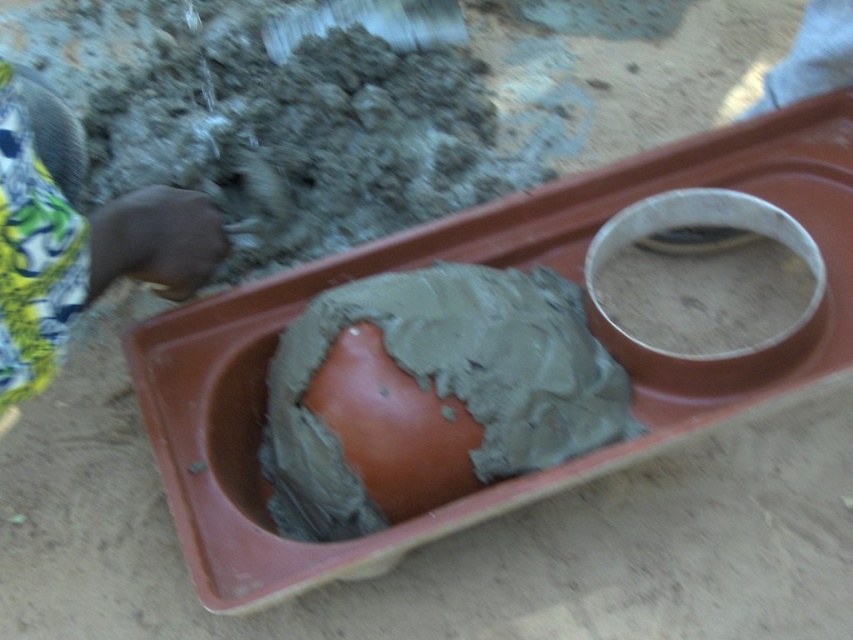
Question: Can you confirm if gray matte mud at center is positioned to the right of gray matte mud at upper right?

Choices:
 (A) no
 (B) yes

Answer: (A)

Question: Among these objects, which one is nearest to the camera?

Choices:
 (A) gray matte mud at center
 (B) gray matte mud at upper right
 (C) textured fabric hand at upper left

Answer: (C)

Question: Which is nearer to the gray matte mud at upper right?

Choices:
 (A) gray matte mud at center
 (B) textured fabric hand at upper left

Answer: (A)

Question: Which point is closer to the camera?

Choices:
 (A) gray matte mud at upper right
 (B) textured fabric hand at upper left

Answer: (B)

Question: Is textured fabric hand at upper left positioned at the back of gray matte mud at upper right?

Choices:
 (A) yes
 (B) no

Answer: (B)

Question: Is gray matte mud at center to the right of textured fabric hand at upper left from the viewer's perspective?

Choices:
 (A) no
 (B) yes

Answer: (B)